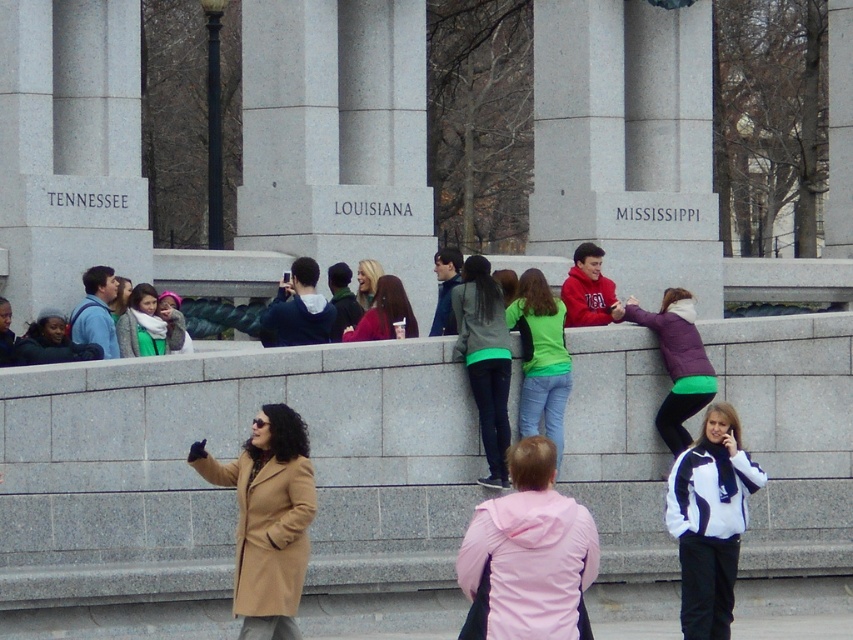
Who is lower down, white/black jacket at center or matte black jacket at center?

white/black jacket at center is lower down.

Does white/black jacket at center have a greater width compared to matte black jacket at center?

Correct, the width of white/black jacket at center exceeds that of matte black jacket at center.

Where is `white/black jacket at center`? white/black jacket at center is located at coordinates (711, 520).

Between point (328, 113) and point (28, 29), which one is positioned in front?

Positioned in front is point (28, 29).

Describe the element at coordinates (337, 134) in the screenshot. I see `white marble pillar at center` at that location.

I want to click on white marble pillar at center, so click(337, 134).

Is the position of gray stone pillar at center less distant than that of white marble pillar at center?

No, gray stone pillar at center is further to the viewer.

At what (x,y) coordinates should I click in order to perform the action: click on gray stone pillar at center. Please return your answer as a coordinate pair (x, y). The width and height of the screenshot is (853, 640). Looking at the image, I should click on (625, 141).